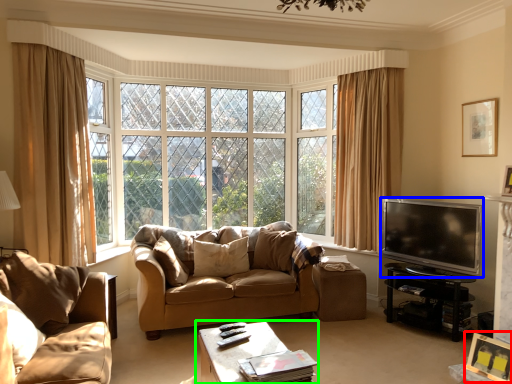
Question: Considering the real-world distances, which object is closest to picture frame (highlighted by a red box)? television (highlighted by a blue box) or table (highlighted by a green box).

Choices:
 (A) television
 (B) table

Answer: (A)